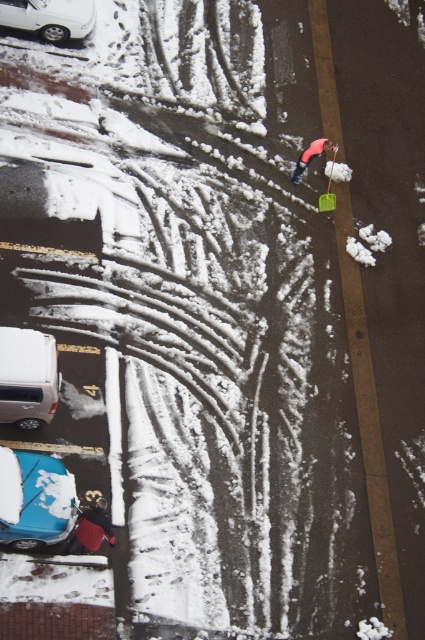
You are standing at the center of the snowy street and see the red fabric bag at lower left. Which direction should you walk to reach it?

The red fabric bag at lower left is located at point (90, 529), so you should walk towards the lower left direction to reach it.